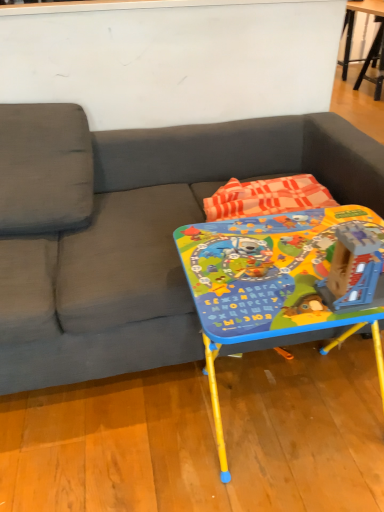
The width and height of the screenshot is (384, 512). What are the coordinates of `vacant area situated to the left side of plastic blue building at center` in the screenshot? It's located at (279, 285).